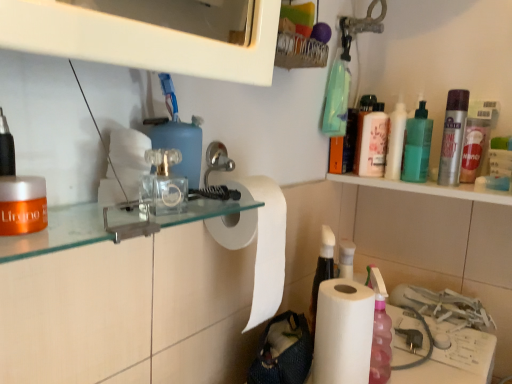
Image resolution: width=512 pixels, height=384 pixels. I want to click on orange matte jar at left, so click(58, 233).

I want to click on green translucent bottle at upper right, acting as the 2th mouthwash starting from the back, so click(417, 146).

Locate an element on the screen. Image resolution: width=512 pixels, height=384 pixels. orange matte jar at left, which appears as the fourth mouthwash when viewed from the right is located at coordinates (22, 205).

What do you see at coordinates (453, 137) in the screenshot? I see `silver metallic mouthwash at upper right, arranged as the 2th mouthwash when viewed from the front` at bounding box center [453, 137].

In order to face pink glossy mouthwash at upper right, which is the first mouthwash in back-to-front order, should I rotate leftwards or rightwards?

You should look right and rotate roughly 16.300 degrees.

This screenshot has height=384, width=512. What are the coordinates of `orange matte jar at left` in the screenshot? It's located at (58, 233).

Is pink glossy mouthwash at upper right, marked as the 4th mouthwash in a front-to-back arrangement, situated inside green translucent bottle at upper right, the third mouthwash in the front-to-back sequence, or outside?

pink glossy mouthwash at upper right, marked as the 4th mouthwash in a front-to-back arrangement, is not enclosed by green translucent bottle at upper right, the third mouthwash in the front-to-back sequence.

Can you confirm if pink glossy mouthwash at upper right, which is counted as the 3th mouthwash, starting from the right, is positioned to the left of green translucent bottle at upper right, the second mouthwash in the right-to-left sequence?

Correct, you'll find pink glossy mouthwash at upper right, which is counted as the 3th mouthwash, starting from the right, to the left of green translucent bottle at upper right, the second mouthwash in the right-to-left sequence.

Are pink glossy mouthwash at upper right, which is the first mouthwash in back-to-front order, and green translucent bottle at upper right, acting as the 2th mouthwash starting from the back, making contact?

Yes, pink glossy mouthwash at upper right, which is the first mouthwash in back-to-front order, is touching green translucent bottle at upper right, acting as the 2th mouthwash starting from the back.

From a real-world perspective, starting from the green translucent bottle at upper right, the third mouthwash in the front-to-back sequence, which mouthwash is the 2nd one below it? Please provide its 2D coordinates.

[(372, 141)]

Between pink glossy mouthwash at upper right, which is counted as the 3th mouthwash, starting from the right, and white paper at lower right, the second paper towel in the left-to-right sequence, which one appears on the right side from the viewer's perspective?

Positioned to the right is pink glossy mouthwash at upper right, which is counted as the 3th mouthwash, starting from the right.

Is pink glossy mouthwash at upper right, which is the first mouthwash in back-to-front order, oriented towards white paper at lower right, the second paper towel in the left-to-right sequence?

No, pink glossy mouthwash at upper right, which is the first mouthwash in back-to-front order, is not facing towards white paper at lower right, the second paper towel in the left-to-right sequence.

How different are the orientations of pink glossy mouthwash at upper right, the 2th mouthwash positioned from the left, and white paper at lower right, the second paper towel in the left-to-right sequence, in degrees?

There is a 90-degree angle between the facing directions of pink glossy mouthwash at upper right, the 2th mouthwash positioned from the left, and white paper at lower right, the second paper towel in the left-to-right sequence.

Is pink glossy mouthwash at upper right, marked as the 4th mouthwash in a front-to-back arrangement, with white paper at lower right, which ranks as the 1th paper towel in right-to-left order?

No, pink glossy mouthwash at upper right, marked as the 4th mouthwash in a front-to-back arrangement, is not beside white paper at lower right, which ranks as the 1th paper towel in right-to-left order.

From the image's perspective, would you say white matte paper towel at center, which is counted as the 1th paper towel, starting from the left, is positioned over white paper at lower right, which ranks as the 1th paper towel in right-to-left order?

Yes.

From a real-world perspective, is white matte paper towel at center, the 2th paper towel in the right-to-left sequence, located beneath white paper at lower right, the second paper towel in the left-to-right sequence?

No, from a real-world perspective, white matte paper towel at center, the 2th paper towel in the right-to-left sequence, is not under white paper at lower right, the second paper towel in the left-to-right sequence.

Is white matte paper towel at center, which is counted as the 1th paper towel, starting from the left, thinner than white paper at lower right, which ranks as the 1th paper towel in right-to-left order?

Incorrect, the width of white matte paper towel at center, which is counted as the 1th paper towel, starting from the left, is not less than that of white paper at lower right, which ranks as the 1th paper towel in right-to-left order.

Measure the distance between white matte paper towel at center, which is counted as the 1th paper towel, starting from the left, and white paper at lower right, the second paper towel in the left-to-right sequence.

The distance of white matte paper towel at center, which is counted as the 1th paper towel, starting from the left, from white paper at lower right, the second paper towel in the left-to-right sequence, is 16.83 centimeters.

Does white paper at lower right, the second paper towel in the left-to-right sequence, have a greater width compared to orange matte jar at left?

No, white paper at lower right, the second paper towel in the left-to-right sequence, is not wider than orange matte jar at left.

In the scene shown: How distant is white paper at lower right, the second paper towel in the left-to-right sequence, from orange matte jar at left?

They are 14.02 inches apart.

From the image's perspective, between white paper at lower right, the second paper towel in the left-to-right sequence, and orange matte jar at left, which one is located above?

orange matte jar at left is shown above in the image.

Considering the positions of points (396, 117) and (377, 145), is point (396, 117) farther from camera compared to point (377, 145)?

Yes, point (396, 117) is behind point (377, 145).

Based on the photo, is pink glossy mouthwash at upper right, marked as the 4th mouthwash in a front-to-back arrangement, surrounded by white glossy bottle at upper right?

Definitely not — pink glossy mouthwash at upper right, marked as the 4th mouthwash in a front-to-back arrangement, is not inside white glossy bottle at upper right.

In terms of size, does white glossy bottle at upper right appear bigger or smaller than orange matte jar at left, placed as the fourth mouthwash when sorted from back to front?

Considering their sizes, white glossy bottle at upper right takes up more space than orange matte jar at left, placed as the fourth mouthwash when sorted from back to front.

How much distance is there between white glossy bottle at upper right and orange matte jar at left, placed as the fourth mouthwash when sorted from back to front?

white glossy bottle at upper right and orange matte jar at left, placed as the fourth mouthwash when sorted from back to front, are 35.44 inches apart from each other.

Can you tell me how much white glossy bottle at upper right and orange matte jar at left, the first mouthwash from the left, differ in facing direction?

The facing directions of white glossy bottle at upper right and orange matte jar at left, the first mouthwash from the left, are 84.8 degrees apart.

Which of these two, white glossy bottle at upper right or orange matte jar at left, placed as the fourth mouthwash when sorted from back to front, stands shorter?

With less height is orange matte jar at left, placed as the fourth mouthwash when sorted from back to front.

Between point (460, 157) and point (132, 193), which one is positioned in front?

Positioned in front is point (132, 193).

Is silver metallic mouthwash at upper right, arranged as the 2th mouthwash when viewed from the front, outside of clear plastic toilet paper at center?

Yes, silver metallic mouthwash at upper right, arranged as the 2th mouthwash when viewed from the front, is not within clear plastic toilet paper at center.

Is silver metallic mouthwash at upper right, the 3th mouthwash from the back, facing towards clear plastic toilet paper at center?

No, silver metallic mouthwash at upper right, the 3th mouthwash from the back, is not aimed at clear plastic toilet paper at center.

From the pink glossy mouthwash at upper right, the 2th mouthwash positioned from the left, count 1st mouthwashs forward and point to it. Please provide its 2D coordinates.

[(417, 146)]

What are the coordinates of `the 2nd mouthwash above the white paper at lower right, which ranks as the 1th paper towel in right-to-left order (from a real-world perspective)` in the screenshot? It's located at 372,141.

Estimate the real-world distances between objects in this image. Which object is closer to orange matte jar at left, placed as the fourth mouthwash when sorted from back to front, pink glossy mouthwash at upper right, marked as the 4th mouthwash in a front-to-back arrangement, or clear plastic toilet paper at center?

The object closer to orange matte jar at left, placed as the fourth mouthwash when sorted from back to front, is clear plastic toilet paper at center.

When comparing their distances from pink glossy mouthwash at upper right, which is counted as the 3th mouthwash, starting from the right, does orange matte jar at left, the first mouthwash from the left, or clear plastic toilet paper at center seem further?

orange matte jar at left, the first mouthwash from the left, is positioned further to the anchor pink glossy mouthwash at upper right, which is counted as the 3th mouthwash, starting from the right.

Estimate the real-world distances between objects in this image. Which object is closer to orange matte jar at left, silver metallic mouthwash at upper right, arranged as the first mouthwash when viewed from the right, or pink glossy mouthwash at upper right, which is the first mouthwash in back-to-front order?

pink glossy mouthwash at upper right, which is the first mouthwash in back-to-front order, is positioned closer to the anchor orange matte jar at left.

Which object lies further to the anchor point white glossy bottle at upper right, green translucent bottle at upper right, the second mouthwash in the right-to-left sequence, or white paper at lower right, which ranks as the 1th paper towel in right-to-left order?

Among the two, white paper at lower right, which ranks as the 1th paper towel in right-to-left order, is located further to white glossy bottle at upper right.

Which object lies nearer to the anchor point clear plastic toilet paper at center, white glossy bottle at upper right or orange matte jar at left?

Based on the image, orange matte jar at left appears to be nearer to clear plastic toilet paper at center.

Looking at the image, which one is located closer to orange matte jar at left, green translucent bottle at upper right, the third mouthwash in the front-to-back sequence, or pink glossy mouthwash at upper right, the 2th mouthwash positioned from the left?

Among the two, pink glossy mouthwash at upper right, the 2th mouthwash positioned from the left, is located nearer to orange matte jar at left.

Estimate the real-world distances between objects in this image. Which object is closer to green translucent bottle at upper right, the third mouthwash in the front-to-back sequence, clear plastic toilet paper at center or silver metallic mouthwash at upper right, arranged as the 2th mouthwash when viewed from the front?

silver metallic mouthwash at upper right, arranged as the 2th mouthwash when viewed from the front, is closer to green translucent bottle at upper right, the third mouthwash in the front-to-back sequence.

Which object lies further to the anchor point pink glossy mouthwash at upper right, marked as the 4th mouthwash in a front-to-back arrangement, green translucent bottle at upper right, the third mouthwash in the front-to-back sequence, or white matte paper towel at center, the 2th paper towel in the right-to-left sequence?

Among the two, white matte paper towel at center, the 2th paper towel in the right-to-left sequence, is located further to pink glossy mouthwash at upper right, marked as the 4th mouthwash in a front-to-back arrangement.

Find the location of a particular element. paper towel between pink glossy mouthwash at upper right, the 2th mouthwash positioned from the left, and white paper at lower right, which ranks as the 1th paper towel in right-to-left order, vertically is located at coordinates (258, 242).

Where is `toilet paper between orange matte jar at left, placed as the fourth mouthwash when sorted from back to front, and silver metallic mouthwash at upper right, arranged as the 2th mouthwash when viewed from the front, in the horizontal direction`? The image size is (512, 384). toilet paper between orange matte jar at left, placed as the fourth mouthwash when sorted from back to front, and silver metallic mouthwash at upper right, arranged as the 2th mouthwash when viewed from the front, in the horizontal direction is located at coordinates point(124,166).

The width and height of the screenshot is (512, 384). I want to click on toilet paper between orange matte jar at left and pink glossy mouthwash at upper right, which is counted as the 3th mouthwash, starting from the right, from front to back, so click(x=124, y=166).

In order to click on mouthwash between orange matte jar at left and white paper at lower right, which ranks as the 1th paper towel in right-to-left order, along the z-axis in this screenshot , I will do `click(22, 205)`.